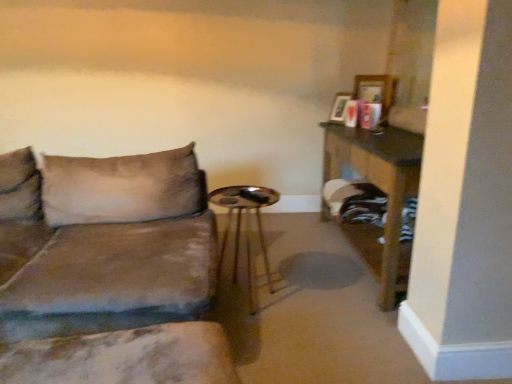
Question: From the image's perspective, relative to velvet brown couch at left, is metallic gold side table at center above or below?

Choices:
 (A) above
 (B) below

Answer: (B)

Question: Is metallic gold side table at center taller or shorter than velvet brown couch at left?

Choices:
 (A) tall
 (B) short

Answer: (B)

Question: Which is nearer to the velvet brown couch at left?

Choices:
 (A) marble-patterned cushion at lower left
 (B) metallic gold side table at center
 (C) wooden table at right

Answer: (A)

Question: Which object is the farthest from the wooden table at right?

Choices:
 (A) marble-patterned cushion at lower left
 (B) velvet brown couch at left
 (C) metallic gold side table at center

Answer: (A)